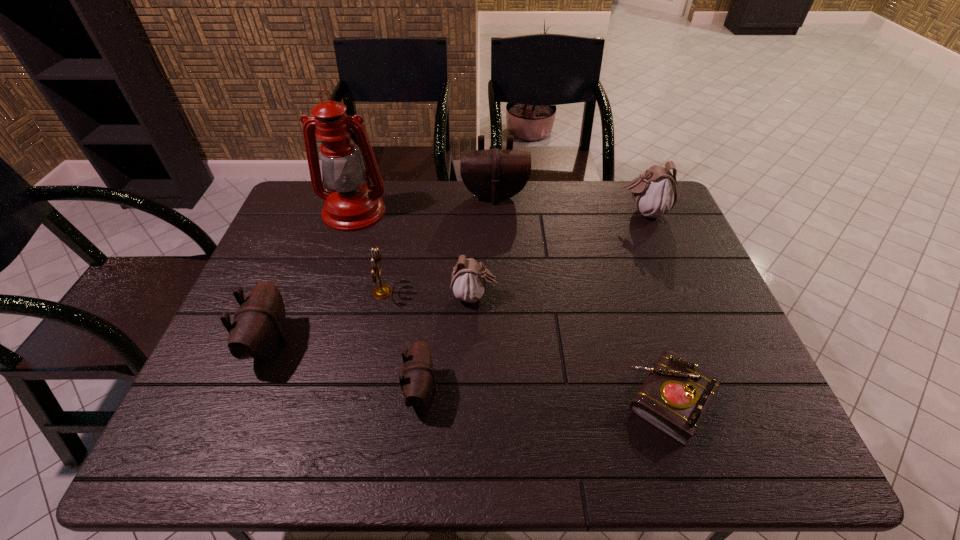
Locate an element on the screen. This screenshot has width=960, height=540. the second closest brown pouch to the right white pouch is located at coordinates (418, 376).

This screenshot has height=540, width=960. I want to click on the closest brown pouch to the farther white pouch, so click(x=495, y=174).

This screenshot has height=540, width=960. In order to click on free spot that satisfies the following two spatial constraints: 1. with the flap open on the second brown pouch from right to left; 2. on the right side of the diary in this screenshot , I will do `click(420, 400)`.

Where is `vacant point that satisfies the following two spatial constraints: 1. on the back side of the diary; 2. on the front-facing side of the nearer white pouch`? vacant point that satisfies the following two spatial constraints: 1. on the back side of the diary; 2. on the front-facing side of the nearer white pouch is located at coordinates (637, 296).

This screenshot has height=540, width=960. What are the coordinates of `free space in the image that satisfies the following two spatial constraints: 1. with the flap open on the farthest brown pouch; 2. on the front-facing side of the smaller white pouch` in the screenshot? It's located at (498, 296).

At what (x,y) coordinates should I click in order to perform the action: click on vacant space that satisfies the following two spatial constraints: 1. on the front-facing side of the rightmost pouch; 2. on the front side of the third object from left to right. Please return your answer as a coordinate pair (x, y). The height and width of the screenshot is (540, 960). Looking at the image, I should click on (676, 292).